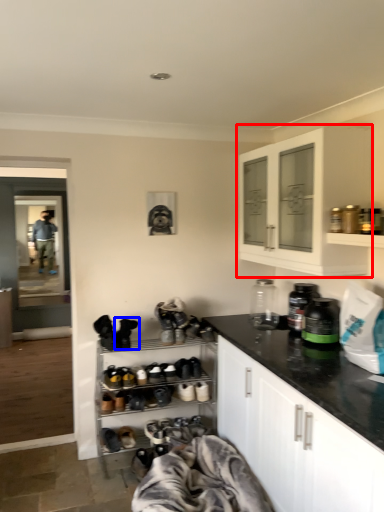
Question: Which point is closer to the camera, cabinetry (highlighted by a red box) or footwear (highlighted by a blue box)?

Choices:
 (A) cabinetry
 (B) footwear

Answer: (A)